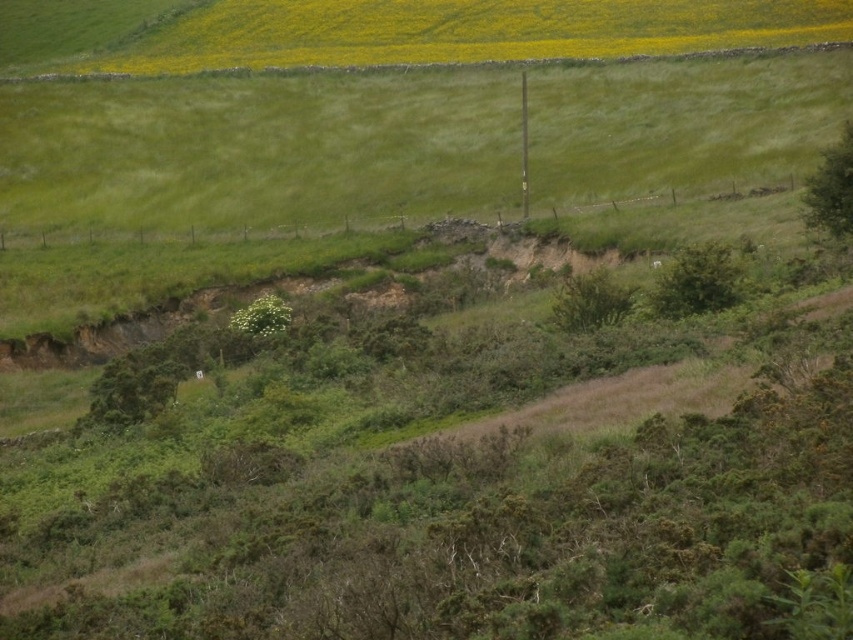
Which is in front, point (639, 144) or point (251, 310)?

Positioned in front is point (251, 310).

Is green grassy hillside at upper center to the right of green leafy plant at center from the viewer's perspective?

Indeed, green grassy hillside at upper center is positioned on the right side of green leafy plant at center.

The width and height of the screenshot is (853, 640). Find the location of `green grassy hillside at upper center`. green grassy hillside at upper center is located at coordinates (258, 148).

This screenshot has height=640, width=853. In order to click on green grassy hillside at upper center in this screenshot , I will do `click(258, 148)`.